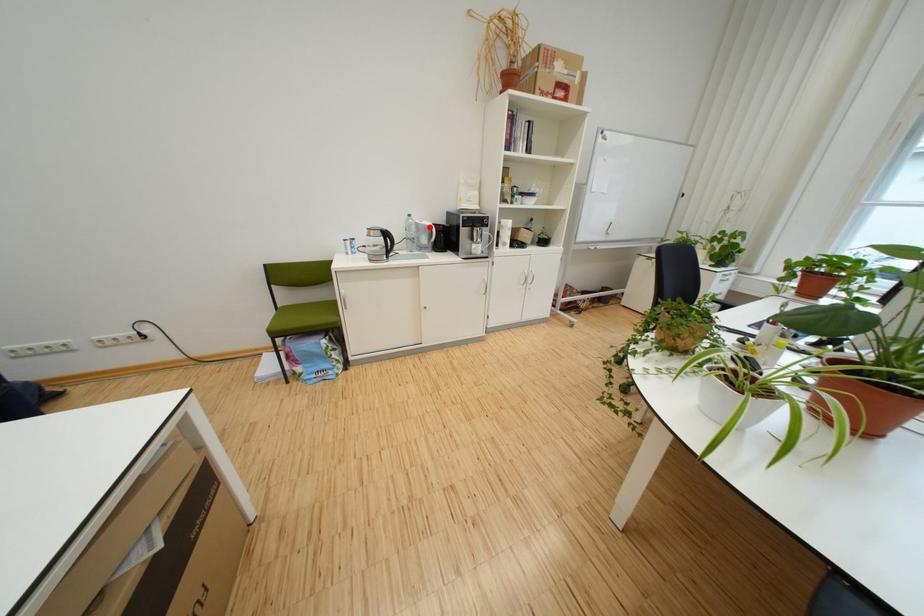
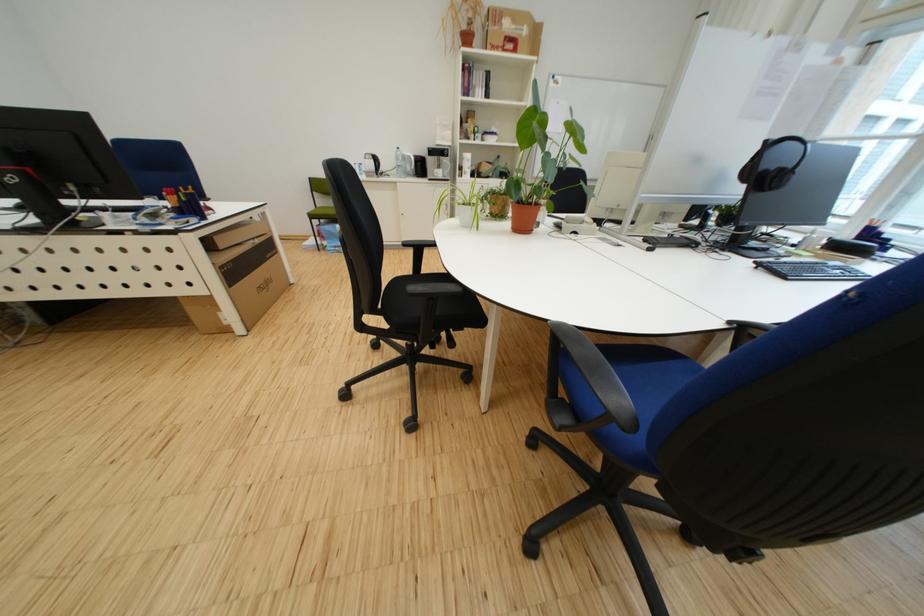
Where in the second image is the point corresponding to the highlighted location from the first image?

(417, 159)